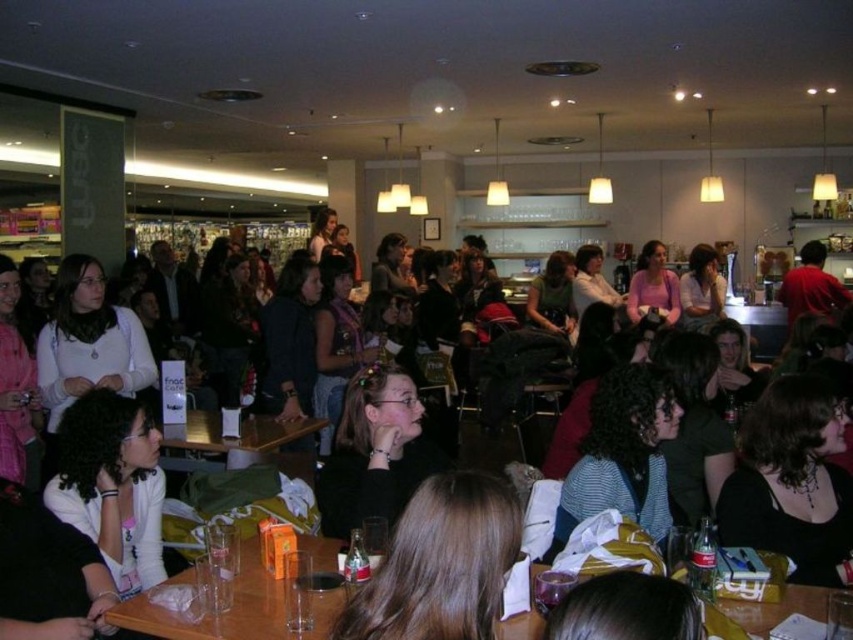
Question: Which point is closer to the camera?

Choices:
 (A) (447, 547)
 (B) (254, 632)

Answer: (A)

Question: Which point is closer to the camera?

Choices:
 (A) striped fabric shirt at center
 (B) wooden table at center

Answer: (A)

Question: Does striped fabric shirt at center lie behind wooden table at center?

Choices:
 (A) yes
 (B) no

Answer: (B)

Question: Is brown hair at center in front of wooden table at center?

Choices:
 (A) yes
 (B) no

Answer: (A)

Question: From the image, what is the correct spatial relationship of brown hair at center in relation to wooden table at center?

Choices:
 (A) right
 (B) left

Answer: (A)

Question: Which point is farther to the camera?

Choices:
 (A) clear plastic cups at lower center
 (B) wooden table at center

Answer: (B)